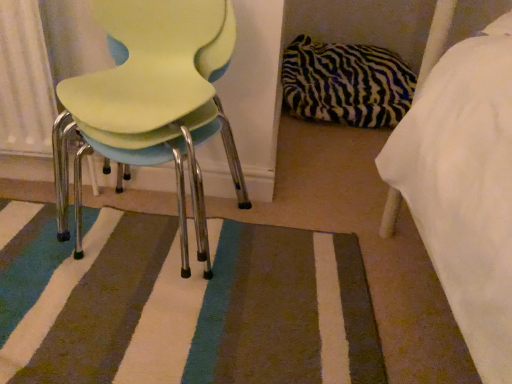
Question: Is striped carpet at center wider than zebra-patterned pillow at center-right?

Choices:
 (A) yes
 (B) no

Answer: (B)

Question: Is there a large distance between striped carpet at center and zebra-patterned pillow at center-right?

Choices:
 (A) no
 (B) yes

Answer: (B)

Question: Can you confirm if striped carpet at center is positioned to the right of zebra-patterned pillow at center-right?

Choices:
 (A) no
 (B) yes

Answer: (A)

Question: Is striped carpet at center looking in the opposite direction of zebra-patterned pillow at center-right?

Choices:
 (A) yes
 (B) no

Answer: (B)

Question: From the image's perspective, does striped carpet at center appear lower than zebra-patterned pillow at center-right?

Choices:
 (A) no
 (B) yes

Answer: (B)

Question: In the image, is matte plastic chair at left positioned in front of or behind zebra-patterned pillow at center-right?

Choices:
 (A) front
 (B) behind

Answer: (A)

Question: Which is correct: matte plastic chair at left is inside zebra-patterned pillow at center-right, or outside of it?

Choices:
 (A) outside
 (B) inside

Answer: (A)

Question: Looking at their shapes, would you say matte plastic chair at left is wider or thinner than zebra-patterned pillow at center-right?

Choices:
 (A) thin
 (B) wide

Answer: (A)

Question: Considering the positions of matte plastic chair at left and zebra-patterned pillow at center-right in the image, is matte plastic chair at left bigger or smaller than zebra-patterned pillow at center-right?

Choices:
 (A) small
 (B) big

Answer: (A)

Question: Is point (79, 97) positioned closer to the camera than point (215, 271)?

Choices:
 (A) closer
 (B) farther

Answer: (A)

Question: Choose the correct answer: Is matte plastic chair at left inside striped carpet at center or outside it?

Choices:
 (A) inside
 (B) outside

Answer: (B)

Question: In terms of width, does matte plastic chair at left look wider or thinner when compared to striped carpet at center?

Choices:
 (A) wide
 (B) thin

Answer: (B)

Question: From the image's perspective, is matte plastic chair at left positioned above or below striped carpet at center?

Choices:
 (A) below
 (B) above

Answer: (B)

Question: Is zebra-patterned pillow at center-right in front of or behind matte plastic chair at left in the image?

Choices:
 (A) front
 (B) behind

Answer: (B)

Question: Does point (368, 120) appear closer or farther from the camera than point (209, 74)?

Choices:
 (A) farther
 (B) closer

Answer: (A)